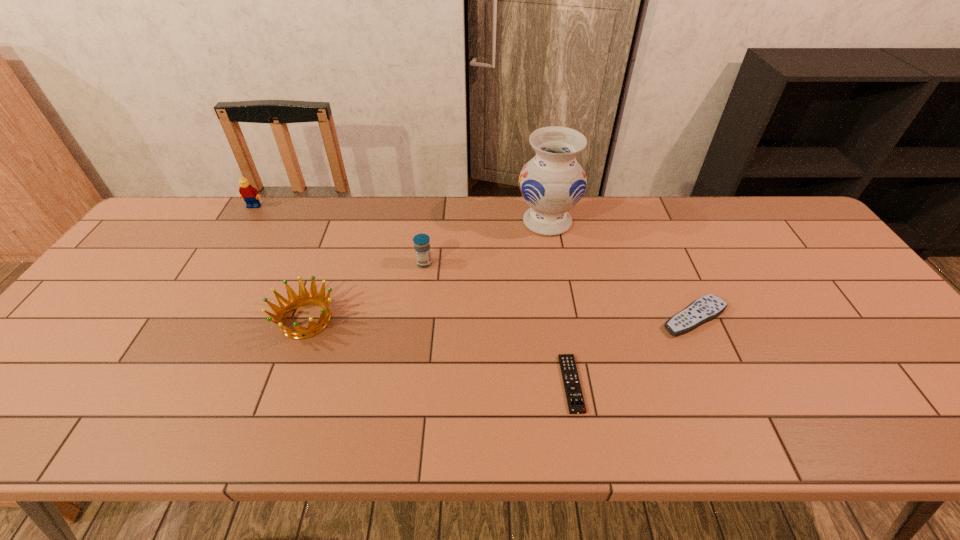
In the image, there is a desktop. Identify the location of vacant space at the left edge. The width and height of the screenshot is (960, 540). (80, 388).

The image size is (960, 540). Identify the location of blank area at the right edge. (897, 388).

This screenshot has height=540, width=960. Identify the location of free space that is in between the second object from left to right and the farther remote control. (500, 319).

Identify the location of vacant point located between the medicine and the nearer remote control. (498, 323).

Image resolution: width=960 pixels, height=540 pixels. I want to click on unoccupied position between the third object from left to right and the vase, so click(x=486, y=242).

The image size is (960, 540). I want to click on empty location between the vase and the second shortest object, so click(x=621, y=270).

Where is `free point between the leftmost object and the right remote control`? free point between the leftmost object and the right remote control is located at coordinates 474,262.

The width and height of the screenshot is (960, 540). In order to click on free area in between the leftmost object and the medicine in this screenshot , I will do `click(339, 235)`.

Find the location of `empty location between the leftmost object and the vase`. empty location between the leftmost object and the vase is located at coordinates (400, 214).

Identify the location of free area in between the Lego and the vase. (400, 214).